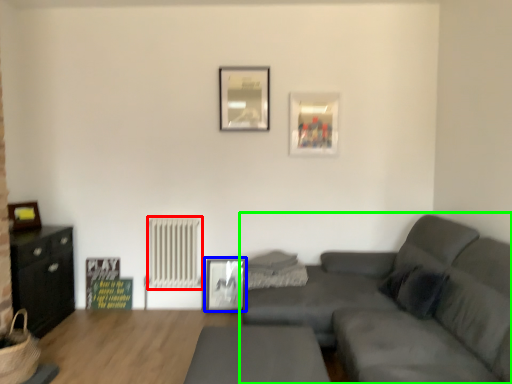
Question: Considering the real-world distances, which object is closest to radiator (highlighted by a red box)? picture frame (highlighted by a blue box) or studio couch (highlighted by a green box).

Choices:
 (A) picture frame
 (B) studio couch

Answer: (A)